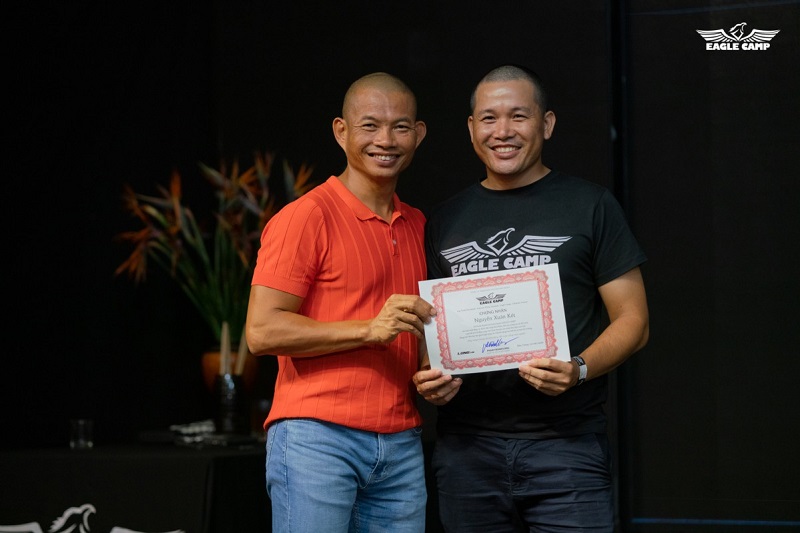
Image resolution: width=800 pixels, height=533 pixels. I want to click on green and orange plant, so click(x=172, y=244).